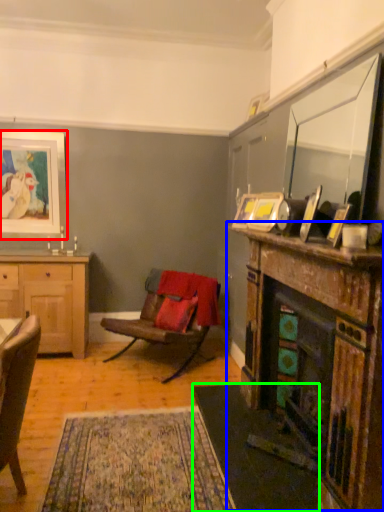
Question: Which is farther away from picture frame (highlighted by a red box)? fireplace (highlighted by a blue box) or carpets (highlighted by a green box)?

Choices:
 (A) fireplace
 (B) carpets

Answer: (A)